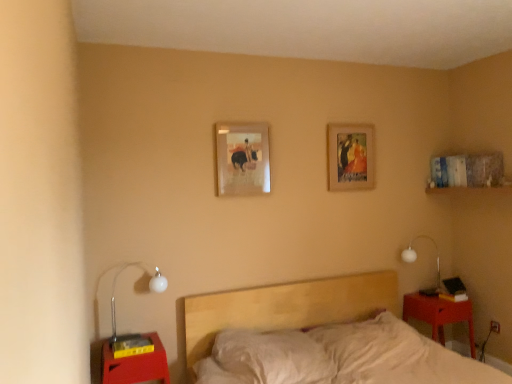
The height and width of the screenshot is (384, 512). In order to click on free spot above matte red wood nightstand at lower right, marked as the first nightstand in a right-to-left arrangement (from a real-world perspective) in this screenshot , I will do `click(425, 297)`.